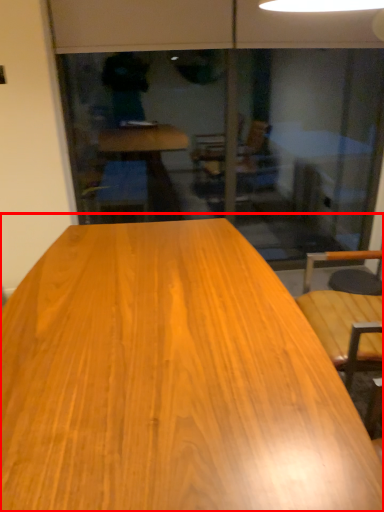
Question: From the image's perspective, what is the correct spatial relationship of table (annotated by the red box) in relation to screen door?

Choices:
 (A) above
 (B) below

Answer: (B)